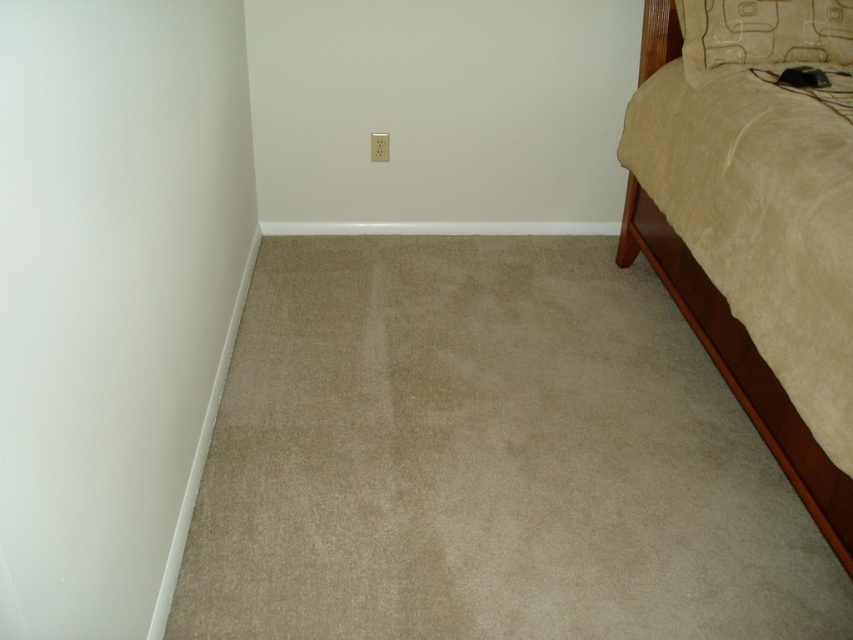
You are standing in the room and want to place a small table between the beige suede bed at right and the beige fabric pillow at upper right. Can you fit it there?

The beige suede bed at right is closer to the viewer than the beige fabric pillow at upper right, so there is space between them for the small table.

You are arranging a minimalist bedroom and need to place a beige fabric pillow at upper right on a beige suede bed at right. Can you place the pillow on the bed without moving the bed?

The beige suede bed at right is below the beige fabric pillow at upper right, so yes, you can place the pillow on the bed without moving it since the pillow is already positioned above the bed.

You are a delivery person placing a small package between the beige suede bed at right and the beige fabric pillow at upper right. Can you fit the package if it measures 24 inches in length?

The distance between the beige suede bed at right and the beige fabric pillow at upper right is 23.99 inches. Since the package is 24 inches long, it will not fit as there is insufficient space.